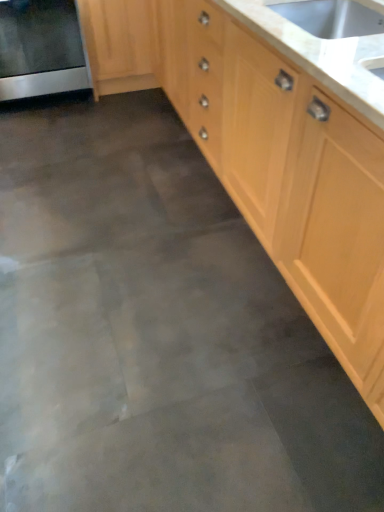
Describe the element at coordinates (321, 55) in the screenshot. The image size is (384, 512). I see `white marble countertop at upper right` at that location.

Find the location of a particular element. satin silver oven at left is located at coordinates (41, 49).

Where is `light wood cabinet at center, positioned as the first cabinetry in right-to-left order`? The width and height of the screenshot is (384, 512). light wood cabinet at center, positioned as the first cabinetry in right-to-left order is located at coordinates (268, 158).

What do you see at coordinates (268, 158) in the screenshot? I see `light wood cabinet at center, positioned as the first cabinetry in right-to-left order` at bounding box center [268, 158].

Find the location of a particular element. white marble countertop at upper right is located at coordinates (321, 55).

Is light wood/texture cabinet at upper left, the 2th cabinetry from the right, positioned in front of light wood cabinet at center, the second cabinetry when ordered from left to right?

No, light wood/texture cabinet at upper left, the 2th cabinetry from the right, is behind light wood cabinet at center, the second cabinetry when ordered from left to right.

Who is bigger, light wood/texture cabinet at upper left, the 1th cabinetry from the left, or light wood cabinet at center, the second cabinetry when ordered from left to right?

With larger size is light wood cabinet at center, the second cabinetry when ordered from left to right.

Which object is wider, light wood/texture cabinet at upper left, the 1th cabinetry from the left, or light wood cabinet at center, positioned as the first cabinetry in right-to-left order?

Wider between the two is light wood/texture cabinet at upper left, the 1th cabinetry from the left.

Looking at this image, from a real-world perspective, is satin silver oven at left over light wood cabinet at center, the second cabinetry when ordered from left to right?

Yes.

What's the angular difference between satin silver oven at left and light wood cabinet at center, the second cabinetry when ordered from left to right,'s facing directions?

They differ by 90.1 degrees in their facing directions.

In terms of height, does satin silver oven at left look taller or shorter compared to light wood cabinet at center, the second cabinetry when ordered from left to right?

In the image, satin silver oven at left appears to be shorter than light wood cabinet at center, the second cabinetry when ordered from left to right.

Is satin silver oven at left in front of or behind light wood cabinet at center, the second cabinetry when ordered from left to right, in the image?

Clearly, satin silver oven at left is behind light wood cabinet at center, the second cabinetry when ordered from left to right.

From the satin silver oven at left, count 1st cabinetry to the right and point to it. Please provide its 2D coordinates.

[(117, 45)]

Considering the positions of objects light wood/texture cabinet at upper left, the 2th cabinetry from the right, and satin silver oven at left in the image provided, who is more to the right, light wood/texture cabinet at upper left, the 2th cabinetry from the right, or satin silver oven at left?

light wood/texture cabinet at upper left, the 2th cabinetry from the right, is more to the right.

From the image's perspective, which one is positioned higher, light wood/texture cabinet at upper left, the 1th cabinetry from the left, or satin silver oven at left?

From the image's view, light wood/texture cabinet at upper left, the 1th cabinetry from the left, is above.

Is light wood/texture cabinet at upper left, the 2th cabinetry from the right, looking in the opposite direction of satin silver oven at left?

No, light wood/texture cabinet at upper left, the 2th cabinetry from the right,'s orientation is not away from satin silver oven at left.

From a real-world perspective, which object rests below the other?

light wood/texture cabinet at upper left, the 2th cabinetry from the right, is physically lower.

Locate an element on the screen. This screenshot has width=384, height=512. the 2nd cabinetry located beneath the white marble countertop at upper right (from a real-world perspective) is located at coordinates (117, 45).

Can we say white marble countertop at upper right lies outside light wood/texture cabinet at upper left, the 1th cabinetry from the left?

Yes, white marble countertop at upper right is not within light wood/texture cabinet at upper left, the 1th cabinetry from the left.

Who is smaller, white marble countertop at upper right or light wood/texture cabinet at upper left, the 2th cabinetry from the right?

white marble countertop at upper right.

Based on the photo, considering the positions of objects white marble countertop at upper right and satin silver oven at left in the image provided, who is behind, white marble countertop at upper right or satin silver oven at left?

satin silver oven at left is behind.

From a real-world perspective, is white marble countertop at upper right physically located above or below satin silver oven at left?

white marble countertop at upper right is situated higher than satin silver oven at left in the real world.

Looking at their sizes, would you say white marble countertop at upper right is wider or thinner than satin silver oven at left?

Considering their sizes, white marble countertop at upper right looks slimmer than satin silver oven at left.

From the image's perspective, who appears lower, white marble countertop at upper right or satin silver oven at left?

white marble countertop at upper right, from the image's perspective.

Which object is closer to the camera taking this photo, light wood cabinet at center, the second cabinetry when ordered from left to right, or light wood/texture cabinet at upper left, the 1th cabinetry from the left?

light wood cabinet at center, the second cabinetry when ordered from left to right.

Between light wood cabinet at center, positioned as the first cabinetry in right-to-left order, and light wood/texture cabinet at upper left, the 1th cabinetry from the left, which one appears on the left side from the viewer's perspective?

light wood/texture cabinet at upper left, the 1th cabinetry from the left, is more to the left.

Looking at their sizes, would you say light wood cabinet at center, the second cabinetry when ordered from left to right, is wider or thinner than light wood/texture cabinet at upper left, the 2th cabinetry from the right?

light wood cabinet at center, the second cabinetry when ordered from left to right, is thinner than light wood/texture cabinet at upper left, the 2th cabinetry from the right.

From a real-world perspective, is light wood cabinet at center, positioned as the first cabinetry in right-to-left order, below light wood/texture cabinet at upper left, the 1th cabinetry from the left?

No, from a real-world perspective, light wood cabinet at center, positioned as the first cabinetry in right-to-left order, is not beneath light wood/texture cabinet at upper left, the 1th cabinetry from the left.

Is light wood cabinet at center, positioned as the first cabinetry in right-to-left order, positioned beyond the bounds of satin silver oven at left?

Yes, light wood cabinet at center, positioned as the first cabinetry in right-to-left order, is located beyond the bounds of satin silver oven at left.

From a real-world perspective, is light wood cabinet at center, positioned as the first cabinetry in right-to-left order, on satin silver oven at left?

No, from a real-world perspective, light wood cabinet at center, positioned as the first cabinetry in right-to-left order, is not on top of satin silver oven at left.

Is light wood cabinet at center, positioned as the first cabinetry in right-to-left order, bigger or smaller than satin silver oven at left?

Considering their sizes, light wood cabinet at center, positioned as the first cabinetry in right-to-left order, takes up more space than satin silver oven at left.

In the scene shown: Does light wood cabinet at center, positioned as the first cabinetry in right-to-left order, touch satin silver oven at left?

No, light wood cabinet at center, positioned as the first cabinetry in right-to-left order, is not making contact with satin silver oven at left.

Where is `cabinetry lying in front of the light wood/texture cabinet at upper left, the 1th cabinetry from the left`? The image size is (384, 512). cabinetry lying in front of the light wood/texture cabinet at upper left, the 1th cabinetry from the left is located at coordinates (268, 158).

You are a GUI agent. You are given a task and a screenshot of the screen. Output one action in this format:
    pyautogui.click(x=<x>, y=<y>)
    Task: Click on the cabinetry that is below the satin silver oven at left (from the image's perspective)
    Image resolution: width=384 pixels, height=512 pixels.
    Given the screenshot: What is the action you would take?
    pyautogui.click(x=268, y=158)

Which object lies nearer to the anchor point satin silver oven at left, light wood cabinet at center, the second cabinetry when ordered from left to right, or white marble countertop at upper right?

Based on the image, light wood cabinet at center, the second cabinetry when ordered from left to right, appears to be nearer to satin silver oven at left.

Based on their spatial positions, is light wood/texture cabinet at upper left, the 2th cabinetry from the right, or satin silver oven at left further from light wood cabinet at center, the second cabinetry when ordered from left to right?

Among the two, satin silver oven at left is located further to light wood cabinet at center, the second cabinetry when ordered from left to right.

Considering their positions, is light wood/texture cabinet at upper left, the 2th cabinetry from the right, positioned closer to white marble countertop at upper right than light wood cabinet at center, the second cabinetry when ordered from left to right?

The object closer to white marble countertop at upper right is light wood cabinet at center, the second cabinetry when ordered from left to right.

Estimate the real-world distances between objects in this image. Which object is further from white marble countertop at upper right, light wood cabinet at center, the second cabinetry when ordered from left to right, or light wood/texture cabinet at upper left, the 2th cabinetry from the right?

Among the two, light wood/texture cabinet at upper left, the 2th cabinetry from the right, is located further to white marble countertop at upper right.

Considering their positions, is white marble countertop at upper right positioned closer to satin silver oven at left than light wood/texture cabinet at upper left, the 2th cabinetry from the right?

light wood/texture cabinet at upper left, the 2th cabinetry from the right.

Considering their positions, is light wood cabinet at center, positioned as the first cabinetry in right-to-left order, positioned closer to satin silver oven at left than light wood/texture cabinet at upper left, the 1th cabinetry from the left?

light wood/texture cabinet at upper left, the 1th cabinetry from the left, is positioned closer to the anchor satin silver oven at left.

Looking at the image, which one is located closer to white marble countertop at upper right, satin silver oven at left or light wood/texture cabinet at upper left, the 1th cabinetry from the left?

light wood/texture cabinet at upper left, the 1th cabinetry from the left, lies closer to white marble countertop at upper right than the other object.

Looking at this image, estimate the real-world distances between objects in this image. Which object is closer to white marble countertop at upper right, light wood cabinet at center, the second cabinetry when ordered from left to right, or satin silver oven at left?

light wood cabinet at center, the second cabinetry when ordered from left to right.

At what (x,y) coordinates should I click in order to perform the action: click on countertop between light wood cabinet at center, positioned as the first cabinetry in right-to-left order, and satin silver oven at left in the front-back direction. Please return your answer as a coordinate pair (x, y). The image size is (384, 512). Looking at the image, I should click on (321, 55).

The width and height of the screenshot is (384, 512). Identify the location of oven between light wood cabinet at center, positioned as the first cabinetry in right-to-left order, and light wood/texture cabinet at upper left, the 1th cabinetry from the left, in the front-back direction. (41, 49).

You are a GUI agent. You are given a task and a screenshot of the screen. Output one action in this format:
    pyautogui.click(x=<x>, y=<y>)
    Task: Click on the countertop between light wood cabinet at center, positioned as the first cabinetry in right-to-left order, and light wood/texture cabinet at upper left, the 2th cabinetry from the right, along the z-axis
    
    Given the screenshot: What is the action you would take?
    pyautogui.click(x=321, y=55)

The width and height of the screenshot is (384, 512). I want to click on oven located between white marble countertop at upper right and light wood/texture cabinet at upper left, the 1th cabinetry from the left, in the depth direction, so point(41,49).